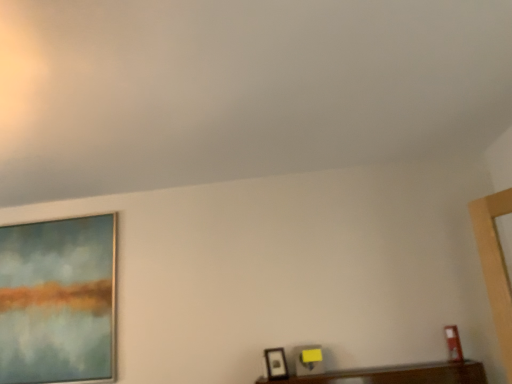
Question: Relative to matte black picture frame at lower right, the 3th picture frame positioned from the back, is matte glass painting at left, which is the 1th picture frame from back to front, in front or behind?

Choices:
 (A) front
 (B) behind

Answer: (B)

Question: In terms of height, does matte glass painting at left, positioned as the first picture frame in left-to-right order, look taller or shorter compared to matte black picture frame at lower right, the 1th picture frame positioned from the front?

Choices:
 (A) short
 (B) tall

Answer: (B)

Question: Estimate the real-world distances between objects in this image. Which object is farther from the matte black picture frame at lower center, the second picture frame positioned from the front?

Choices:
 (A) matte glass painting at left, acting as the third picture frame starting from the right
 (B) matte black picture frame at lower right, which is counted as the third picture frame, starting from the left

Answer: (A)

Question: Which object is the farthest from the matte glass painting at left, which is counted as the 3th picture frame, starting from the front?

Choices:
 (A) matte black picture frame at lower right, which is counted as the third picture frame, starting from the left
 (B) matte black picture frame at lower center, positioned as the second picture frame in left-to-right order

Answer: (A)